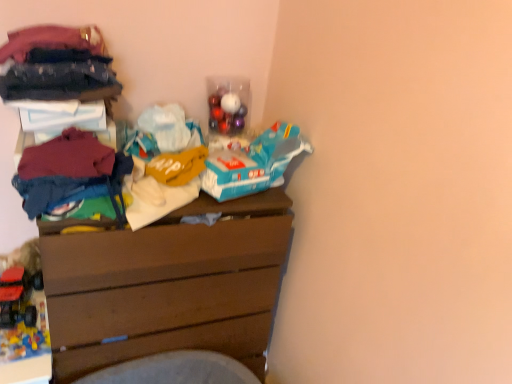
This screenshot has height=384, width=512. Identify the location of empty space that is ontop of dark blue fabric at upper left, which is the 2th clothing from top to bottom (from a real-world perspective). (61, 61).